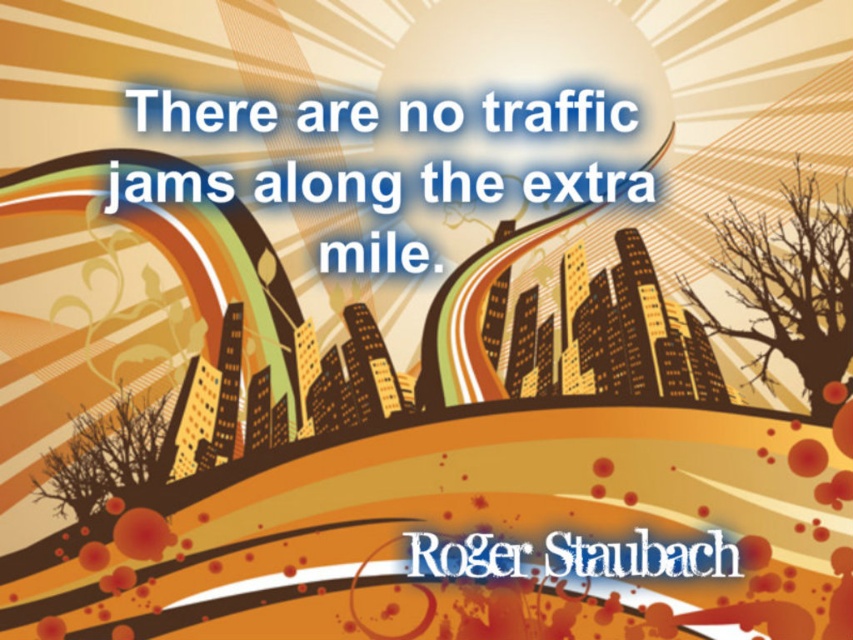
Question: Can you confirm if whitematerial/texturetext at upper center is positioned to the right of black metallic roger staubach at center?

Choices:
 (A) no
 (B) yes

Answer: (A)

Question: Is whitematerial/texturetext at upper center wider than black metallic roger staubach at center?

Choices:
 (A) no
 (B) yes

Answer: (B)

Question: Does whitematerial/texturetext at upper center have a larger size compared to black metallic roger staubach at center?

Choices:
 (A) yes
 (B) no

Answer: (A)